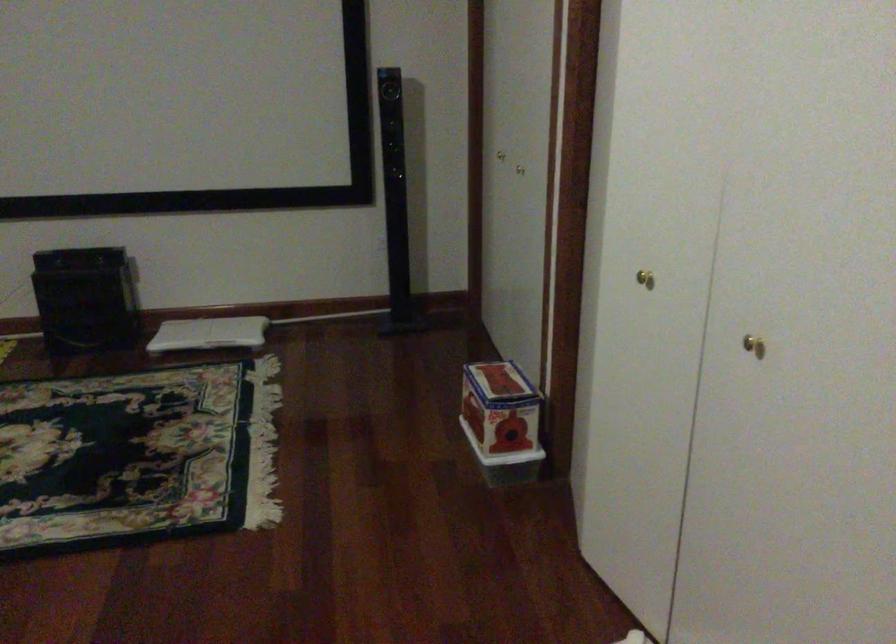
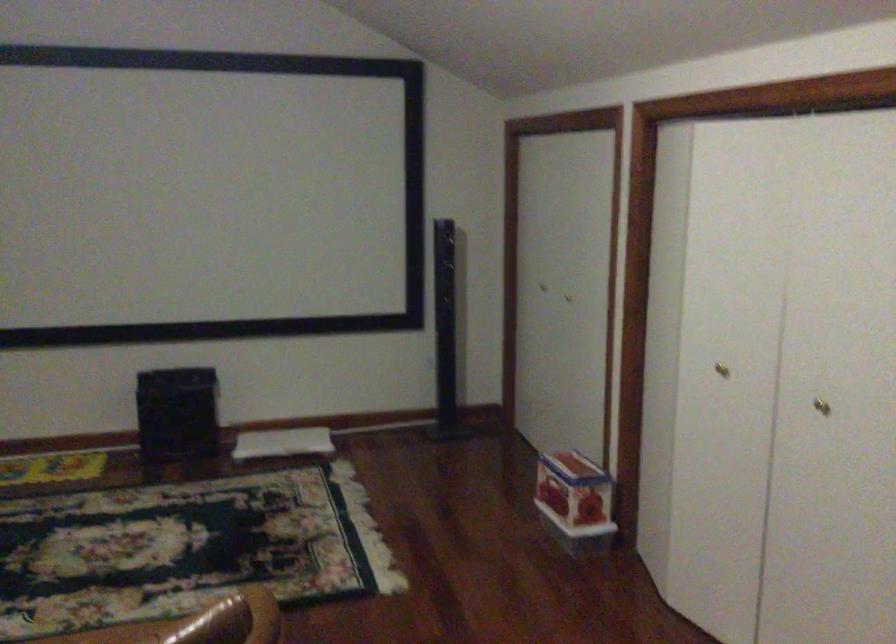
Locate, in the second image, the point that corresponds to [648,279] in the first image.

(721, 368)